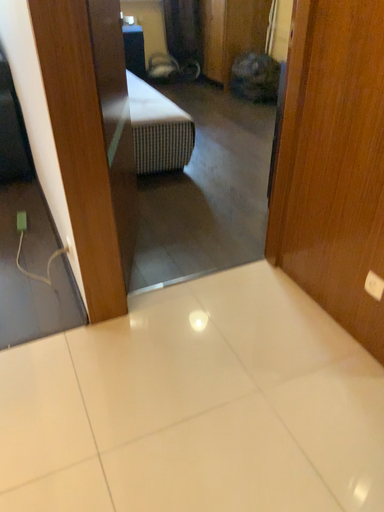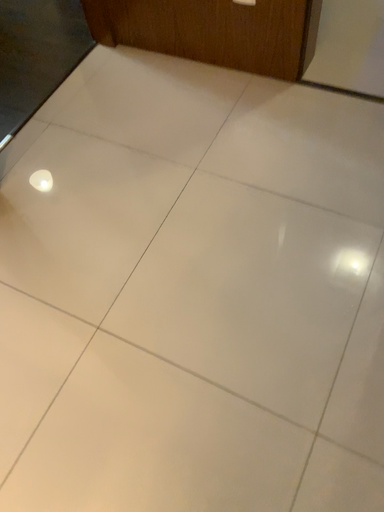
Question: Which way did the camera rotate in the video?

Choices:
 (A) rotated right
 (B) rotated left

Answer: (A)